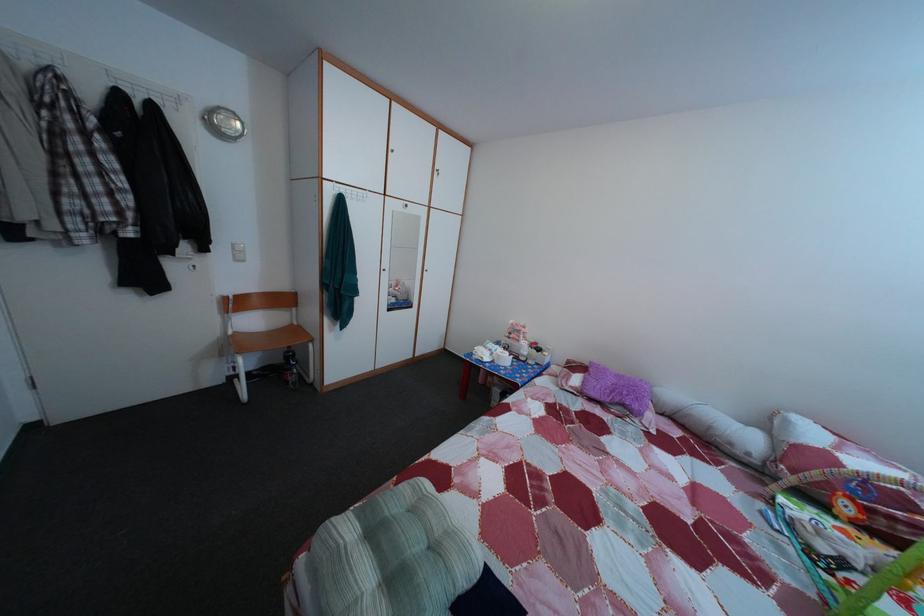
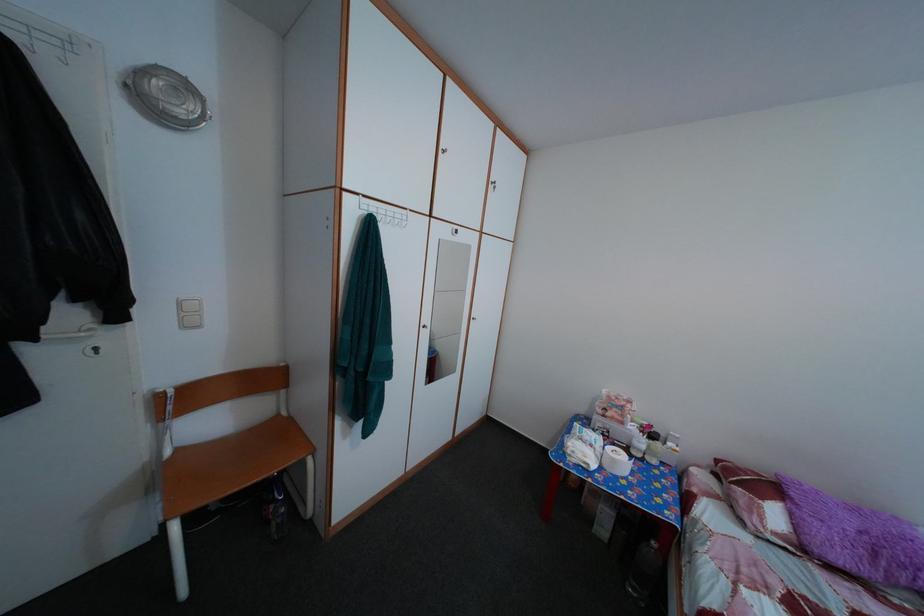
Which direction would the cameraman need to move to produce the second image?

The movement direction of the cameraman is left, forward.